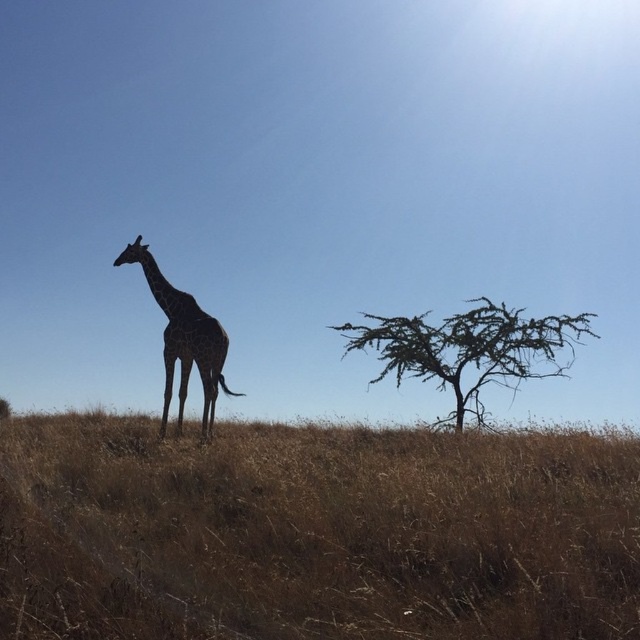
Does dry grass at center appear under spotted fur giraffe at center?

Yes, dry grass at center is below spotted fur giraffe at center.

Looking at this image, is dry grass at center to the right of spotted fur giraffe at center from the viewer's perspective?

Indeed, dry grass at center is positioned on the right side of spotted fur giraffe at center.

What do you see at coordinates (314, 532) in the screenshot? The width and height of the screenshot is (640, 640). I see `dry grass at center` at bounding box center [314, 532].

You are a GUI agent. You are given a task and a screenshot of the screen. Output one action in this format:
    pyautogui.click(x=<x>, y=<y>)
    Task: Click on the dry grass at center
    The image size is (640, 640).
    Given the screenshot: What is the action you would take?
    pyautogui.click(x=314, y=532)

Can you confirm if brown textured tree at right is positioned to the right of spotted fur giraffe at center?

Indeed, brown textured tree at right is positioned on the right side of spotted fur giraffe at center.

Based on the photo, can you confirm if brown textured tree at right is smaller than spotted fur giraffe at center?

Indeed, brown textured tree at right has a smaller size compared to spotted fur giraffe at center.

Is point (529, 360) in front of point (147, 269)?

That is False.

What are the coordinates of `brown textured tree at right` in the screenshot? It's located at (468, 349).

Between point (531, 541) and point (444, 346), which one is positioned in front?

Positioned in front is point (531, 541).

Between dry grass at center and brown textured tree at right, which one appears on the right side from the viewer's perspective?

Positioned to the right is brown textured tree at right.

Which is behind, point (595, 592) or point (488, 364)?

Point (488, 364)

The image size is (640, 640). I want to click on dry grass at center, so click(x=314, y=532).